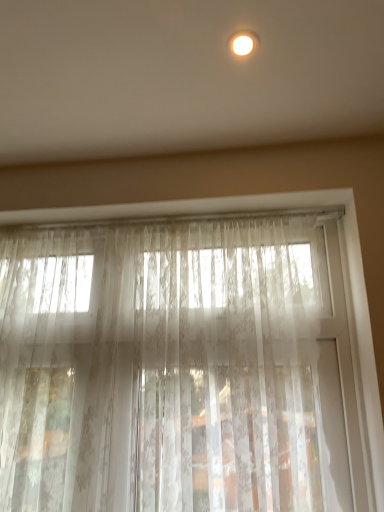
Question: Considering the positions of sheer white lace curtain at center and matte white light fixture at upper center in the image, is sheer white lace curtain at center bigger or smaller than matte white light fixture at upper center?

Choices:
 (A) big
 (B) small

Answer: (A)

Question: In the image, is sheer white lace curtain at center positioned in front of or behind matte white light fixture at upper center?

Choices:
 (A) front
 (B) behind

Answer: (B)

Question: Looking at their shapes, would you say sheer white lace curtain at center is wider or thinner than matte white light fixture at upper center?

Choices:
 (A) wide
 (B) thin

Answer: (B)

Question: From the image's perspective, is matte white light fixture at upper center above or below sheer white lace curtain at center?

Choices:
 (A) above
 (B) below

Answer: (A)

Question: Considering the positions of point (231, 35) and point (241, 435), is point (231, 35) closer or farther from the camera than point (241, 435)?

Choices:
 (A) closer
 (B) farther

Answer: (A)

Question: In terms of width, does matte white light fixture at upper center look wider or thinner when compared to sheer white lace curtain at center?

Choices:
 (A) wide
 (B) thin

Answer: (A)

Question: In the image, is matte white light fixture at upper center positioned in front of or behind sheer white lace curtain at center?

Choices:
 (A) behind
 (B) front

Answer: (B)